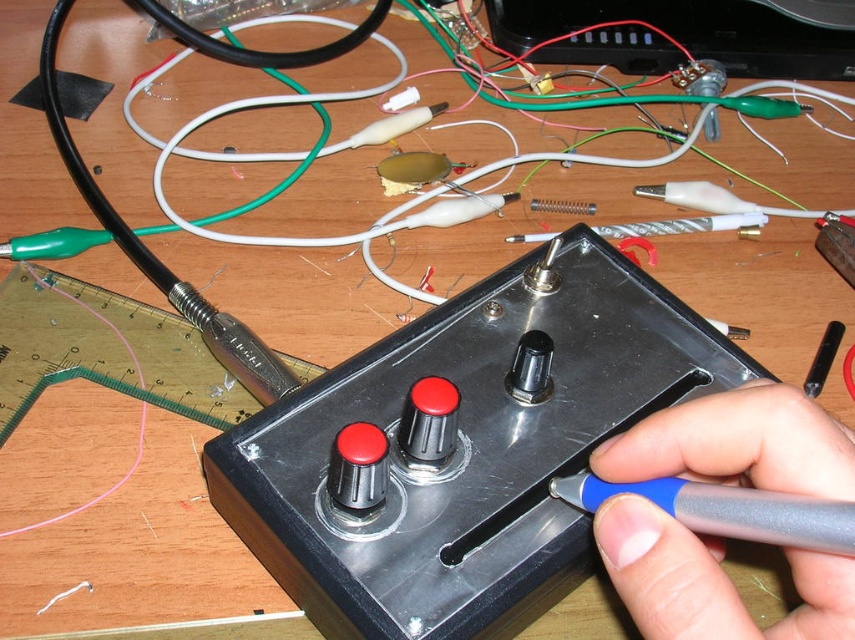
You are an engineer working on the workspace shown. You need to place a new tool that is 10 cm in height next to the black metallic control panel at center and the gray plastic pen at center. Based on their sizes, which object will the new tool be taller than?

The black metallic control panel at center is much taller than the gray plastic pen at center. Since the new tool is 10 cm in height, it will be taller than the gray plastic pen at center if the pen is shorter than 10 cm. However, without knowing the exact height of the pen, we cannot definitively determine which object the new tool will be taller than. Please provide more information about the pen.

You are an engineer working on the workspace shown. You need to locate the black metallic control panel at center. What are its coordinates?

The black metallic control panel at center is located at coordinates point (x=463, y=448).